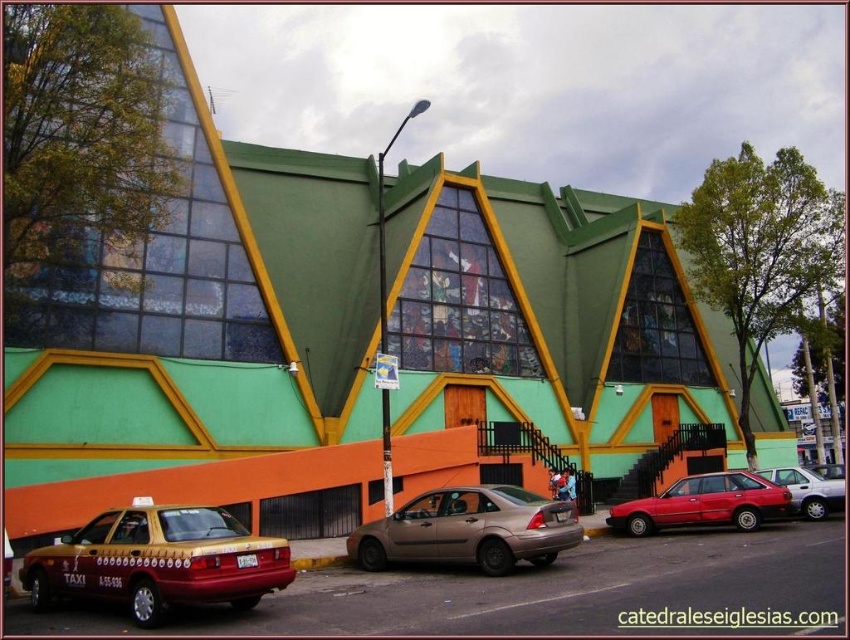
You are standing in front of the building and want to take a photo. You notice two points marked on the building facade at coordinates point (678, 504) and point (826, 476). Which point will appear larger in your camera view?

Point (678, 504) is closer to the camera than point (826, 476), so it will appear larger in the camera view.